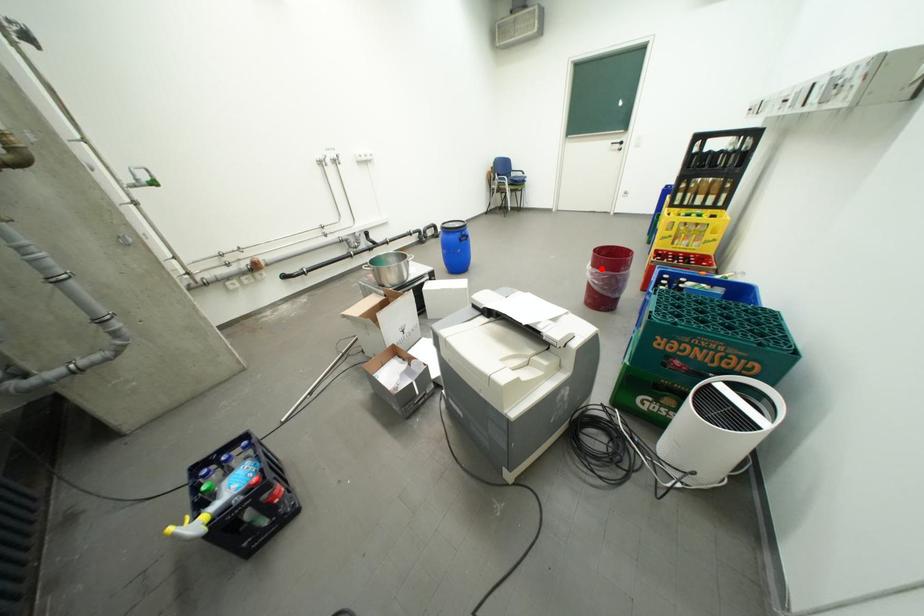
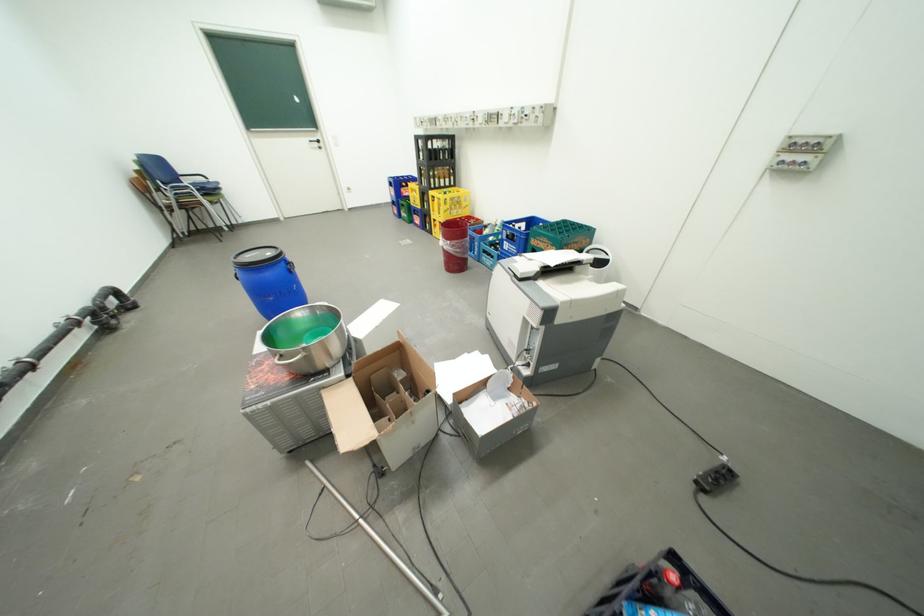
Question: I am providing you with two images of the same scene from different viewpoints. A red point is shown in image1. For the corresponding object point in image2, is it positioned nearer or farther from the camera?

Choices:
 (A) Nearer
 (B) Farther

Answer: (A)